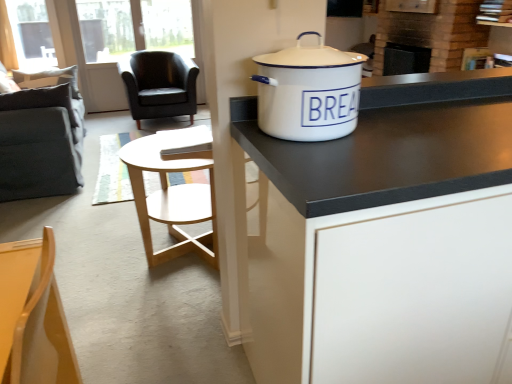
Where is `free location to the right of white enamel pot at upper right`? Image resolution: width=512 pixels, height=384 pixels. free location to the right of white enamel pot at upper right is located at coordinates (410, 134).